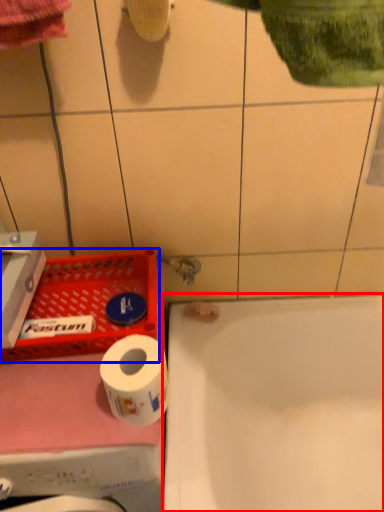
Question: Which of the following is the closest to the observer, bathtub (highlighted by a red box) or laundry basket (highlighted by a blue box)?

Choices:
 (A) bathtub
 (B) laundry basket

Answer: (A)